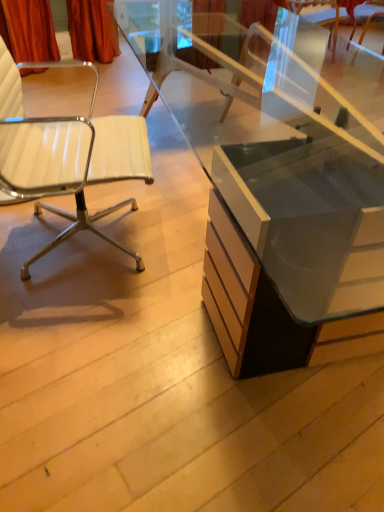
Question: From a real-world perspective, is white leather chair at upper right, acting as the first chair starting from the back, physically below white leather chair at left, which ranks as the second chair in top-to-bottom order?

Choices:
 (A) yes
 (B) no

Answer: (A)

Question: Is white leather chair at upper right, arranged as the first chair when viewed from the right, shorter than white leather chair at left, which ranks as the first chair in bottom-to-top order?

Choices:
 (A) yes
 (B) no

Answer: (A)

Question: Is the position of white leather chair at upper right, acting as the first chair starting from the back, less distant than that of white leather chair at left, which is the first chair in left-to-right order?

Choices:
 (A) no
 (B) yes

Answer: (A)

Question: Is white leather chair at upper right, which is the 2th chair in bottom-to-top order, wider than white leather chair at left, which ranks as the 2th chair in back-to-front order?

Choices:
 (A) yes
 (B) no

Answer: (B)

Question: Can white leather chair at left, which is the first chair in left-to-right order, be found inside white leather chair at upper right, which is the 2th chair in bottom-to-top order?

Choices:
 (A) no
 (B) yes

Answer: (A)

Question: In the image, is white leather chair at upper right, which is the 2th chair in bottom-to-top order, on the left side or the right side of matte glass desk at center?

Choices:
 (A) left
 (B) right

Answer: (B)

Question: In terms of width, does white leather chair at upper right, which is the 2th chair in bottom-to-top order, look wider or thinner when compared to matte glass desk at center?

Choices:
 (A) wide
 (B) thin

Answer: (B)

Question: From the image's perspective, is white leather chair at upper right, which is the 2th chair in bottom-to-top order, located above or below matte glass desk at center?

Choices:
 (A) above
 (B) below

Answer: (A)

Question: From a real-world perspective, is white leather chair at upper right, arranged as the first chair when viewed from the right, positioned above or below matte glass desk at center?

Choices:
 (A) below
 (B) above

Answer: (A)

Question: From the image's perspective, is matte glass desk at center above or below white leather chair at left, the 2th chair in the right-to-left sequence?

Choices:
 (A) below
 (B) above

Answer: (B)

Question: Considering the positions of matte glass desk at center and white leather chair at left, which ranks as the first chair in bottom-to-top order, in the image, is matte glass desk at center wider or thinner than white leather chair at left, which ranks as the first chair in bottom-to-top order,?

Choices:
 (A) thin
 (B) wide

Answer: (B)

Question: From their relative heights in the image, would you say matte glass desk at center is taller or shorter than white leather chair at left, which ranks as the first chair in bottom-to-top order?

Choices:
 (A) tall
 (B) short

Answer: (B)

Question: From a real-world perspective, is matte glass desk at center physically located above or below white leather chair at left, which ranks as the first chair in bottom-to-top order?

Choices:
 (A) below
 (B) above

Answer: (A)

Question: From the image's perspective, relative to white leather chair at left, which is the first chair in left-to-right order, is white leather chair at upper right, arranged as the 2th chair when viewed from the left, above or below?

Choices:
 (A) above
 (B) below

Answer: (A)

Question: Choose the correct answer: Is white leather chair at upper right, arranged as the first chair when viewed from the right, inside white leather chair at left, which ranks as the 2th chair in back-to-front order, or outside it?

Choices:
 (A) inside
 (B) outside

Answer: (B)